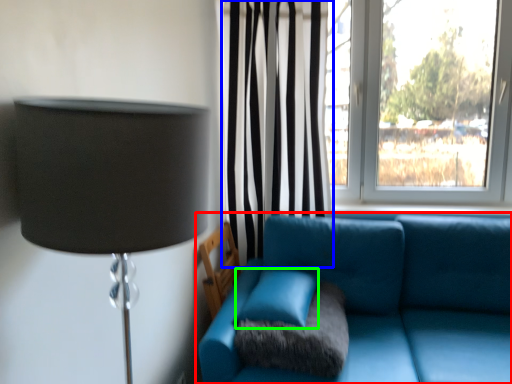
Question: Based on their relative distances, which object is nearer to studio couch (highlighted by a red box)? Choose from curtain (highlighted by a blue box) and turquoise (highlighted by a green box).

Choices:
 (A) curtain
 (B) turquoise

Answer: (B)